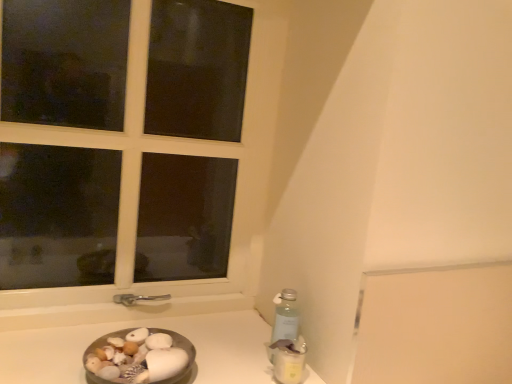
Locate an element on the screen. This screenshot has height=384, width=512. translucent plastic bottle at lower right is located at coordinates (288, 360).

What do you see at coordinates (121, 167) in the screenshot?
I see `white plastic window at upper left` at bounding box center [121, 167].

Locate an element on the screen. Image resolution: width=512 pixels, height=384 pixels. translucent plastic bottle at lower right is located at coordinates (288, 360).

Can you confirm if metallic silver bowl at lower left is positioned to the left of translucent plastic bottle at lower right?

Correct, you'll find metallic silver bowl at lower left to the left of translucent plastic bottle at lower right.

In terms of size, does metallic silver bowl at lower left appear bigger or smaller than translucent plastic bottle at lower right?

Considering their sizes, metallic silver bowl at lower left takes up more space than translucent plastic bottle at lower right.

Locate an element on the screen. bottle above the metallic silver bowl at lower left (from a real-world perspective) is located at coordinates point(288,360).

From the image's perspective, is metallic silver bowl at lower left beneath translucent plastic bottle at lower right?

Indeed, from the image's perspective, metallic silver bowl at lower left is shown beneath translucent plastic bottle at lower right.

In terms of size, does metallic silver bowl at lower left appear bigger or smaller than white plastic window at upper left?

metallic silver bowl at lower left is smaller than white plastic window at upper left.

Does point (117, 326) come farther from viewer compared to point (137, 214)?

That is False.

From a real-world perspective, is metallic silver bowl at lower left located beneath white plastic window at upper left?

Yes, from a real-world perspective, metallic silver bowl at lower left is beneath white plastic window at upper left.

How far apart are metallic silver bowl at lower left and white plastic window at upper left?

metallic silver bowl at lower left is 35.80 centimeters from white plastic window at upper left.

Is white plastic window at upper left touching translucent plastic bottle at lower right?

No, white plastic window at upper left is not with translucent plastic bottle at lower right.

What's the angular difference between white plastic window at upper left and translucent plastic bottle at lower right's facing directions?

7.09 degrees separate the facing orientations of white plastic window at upper left and translucent plastic bottle at lower right.

From a real-world perspective, is white plastic window at upper left positioned over translucent plastic bottle at lower right based on gravity?

Yes.

From their relative heights in the image, would you say white plastic window at upper left is taller or shorter than translucent plastic bottle at lower right?

white plastic window at upper left is taller than translucent plastic bottle at lower right.

Looking at this image, does smooth white shells at lower left come behind metallic silver bowl at lower left?

That is True.

How many degrees apart are the facing directions of smooth white shells at lower left and metallic silver bowl at lower left?

There is a 0.164-degree angle between the facing directions of smooth white shells at lower left and metallic silver bowl at lower left.

Who is smaller, smooth white shells at lower left or metallic silver bowl at lower left?

smooth white shells at lower left is smaller.

From the image's perspective, is smooth white shells at lower left above metallic silver bowl at lower left?

Yes, from the image's perspective, smooth white shells at lower left is on top of metallic silver bowl at lower left.

Considering the relative sizes of smooth white shells at lower left and white plastic window at upper left in the image provided, is smooth white shells at lower left wider than white plastic window at upper left?

Yes.

The image size is (512, 384). In order to click on window to the left of smooth white shells at lower left in this screenshot , I will do `click(121, 167)`.

Is smooth white shells at lower left bigger than white plastic window at upper left?

Incorrect, smooth white shells at lower left is not larger than white plastic window at upper left.

Which object is closer to the camera taking this photo, white plastic window at upper left or smooth white shells at lower left?

smooth white shells at lower left is more forward.

Would you say white plastic window at upper left contains smooth white shells at lower left?

No.

From the picture: From the image's perspective, does white plastic window at upper left appear lower than smooth white shells at lower left?

No.

Is white plastic window at upper left inside or outside of metallic silver bowl at lower left?

white plastic window at upper left lies outside metallic silver bowl at lower left.

Is white plastic window at upper left oriented towards metallic silver bowl at lower left?

Yes, white plastic window at upper left is oriented towards metallic silver bowl at lower left.

Does white plastic window at upper left have a lesser width compared to metallic silver bowl at lower left?

Indeed, white plastic window at upper left has a lesser width compared to metallic silver bowl at lower left.

From a real-world perspective, which object rests below the other?

From a 3D spatial view, metallic silver bowl at lower left is below.

Locate an element on the screen. Image resolution: width=512 pixels, height=384 pixels. bottle behind the metallic silver bowl at lower left is located at coordinates (288, 360).

The height and width of the screenshot is (384, 512). I want to click on counter top below the white plastic window at upper left (from a real-world perspective), so click(x=148, y=327).

Looking at the image, which one is located closer to white plastic window at upper left, smooth white shells at lower left or translucent plastic bottle at lower right?

Among the two, smooth white shells at lower left is located nearer to white plastic window at upper left.

From the image, which object appears to be farther from translucent plastic bottle at lower right, metallic silver bowl at lower left or white plastic window at upper left?

Based on the image, white plastic window at upper left appears to be further to translucent plastic bottle at lower right.

Looking at this image, considering their positions, is white plastic window at upper left positioned further to smooth white shells at lower left than translucent plastic bottle at lower right?

white plastic window at upper left lies further to smooth white shells at lower left than the other object.

Considering their positions, is translucent plastic bottle at lower right positioned closer to metallic silver bowl at lower left than smooth white shells at lower left?

smooth white shells at lower left is positioned closer to the anchor metallic silver bowl at lower left.

In the scene shown: Based on their spatial positions, is white plastic window at upper left or translucent plastic bottle at lower right further from metallic silver bowl at lower left?

The object further to metallic silver bowl at lower left is white plastic window at upper left.

Based on their spatial positions, is translucent plastic bottle at lower right or white plastic window at upper left further from smooth white shells at lower left?

white plastic window at upper left is further to smooth white shells at lower left.

Based on the photo, estimate the real-world distances between objects in this image. Which object is further from smooth white shells at lower left, metallic silver bowl at lower left or translucent plastic bottle at lower right?

translucent plastic bottle at lower right is further to smooth white shells at lower left.

Based on their spatial positions, is metallic silver bowl at lower left or smooth white shells at lower left further from white plastic window at upper left?

Among the two, smooth white shells at lower left is located further to white plastic window at upper left.

Locate an element on the screen. This screenshot has height=384, width=512. food between white plastic window at upper left and metallic silver bowl at lower left in the vertical direction is located at coordinates (139, 358).

Find the location of `counter top between smooth white shells at lower left and translucent plastic bottle at lower right from left to right`. counter top between smooth white shells at lower left and translucent plastic bottle at lower right from left to right is located at coordinates (148, 327).

I want to click on bottle between white plastic window at upper left and metallic silver bowl at lower left in the vertical direction, so click(288, 360).

Image resolution: width=512 pixels, height=384 pixels. Identify the location of food between white plastic window at upper left and translucent plastic bottle at lower right in the vertical direction. (139, 358).